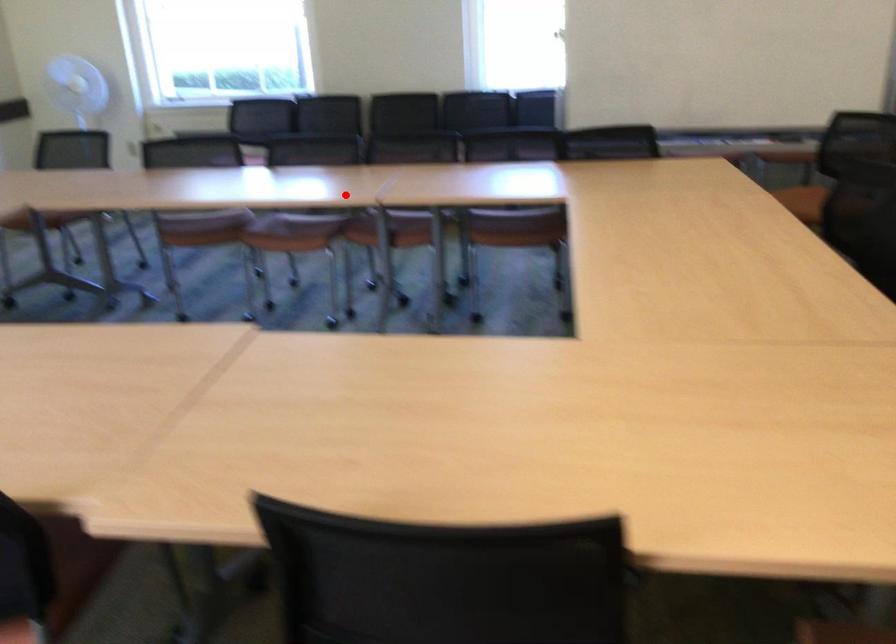
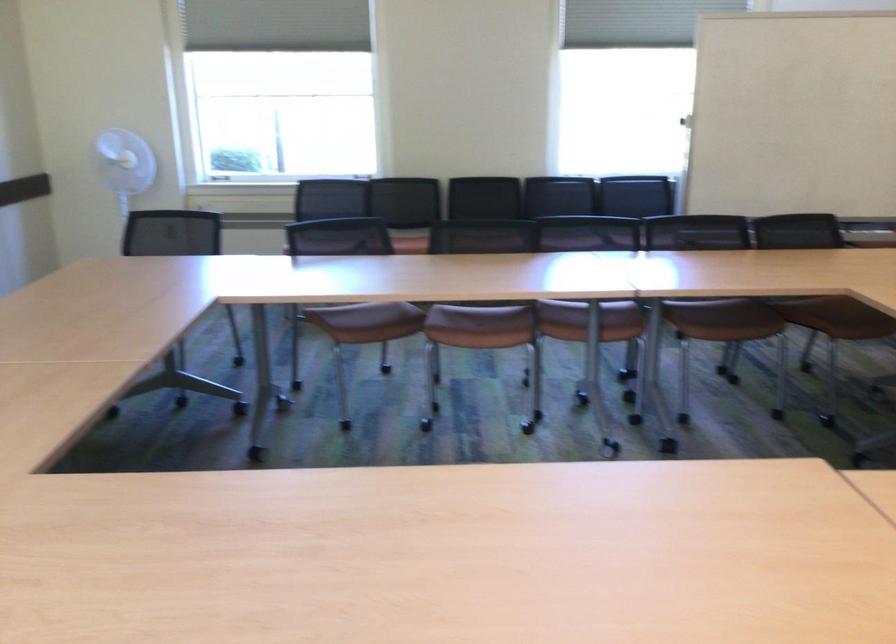
Find the pixel in the second image that matches the highlighted location in the first image.

(590, 292)